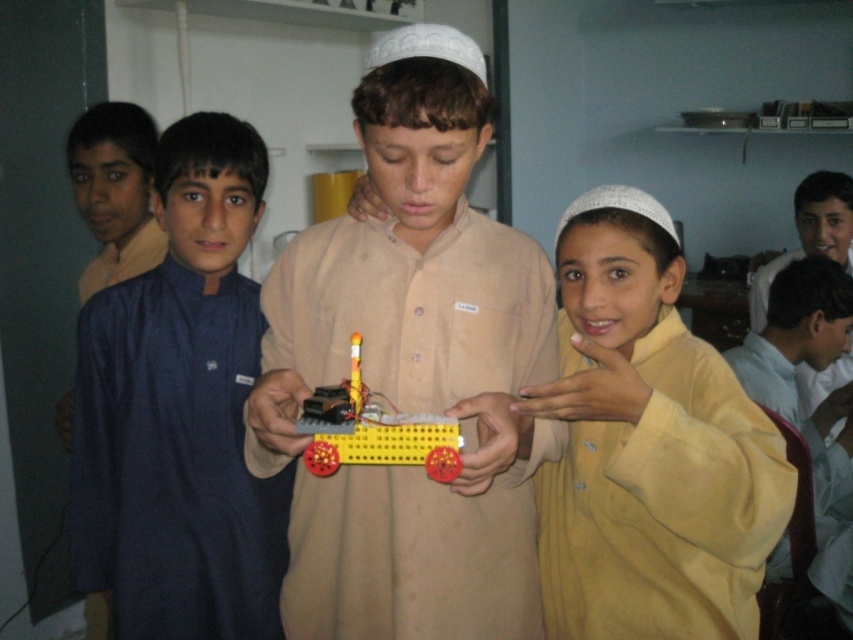
Is yellow matte shirt at lower right to the right of yellow plastic toy at center from the viewer's perspective?

Yes, yellow matte shirt at lower right is to the right of yellow plastic toy at center.

Does yellow matte shirt at lower right have a greater width compared to yellow plastic toy at center?

Yes.

Measure the distance between yellow matte shirt at lower right and camera.

A distance of 2.12 meters exists between yellow matte shirt at lower right and camera.

This screenshot has width=853, height=640. Identify the location of yellow matte shirt at lower right. (819, 404).

Is beige matte shirt at center taller than dark blue fabric at left?

No.

Is point (451, 410) in front of point (97, 406)?

Yes, point (451, 410) is closer to viewer.

Which is in front, point (450, 225) or point (231, 243)?

Point (450, 225)

The image size is (853, 640). Find the location of `beige matte shirt at center`. beige matte shirt at center is located at coordinates (413, 371).

Which is more to the left, yellow plastic toy at center or light blue shirt at upper right?

yellow plastic toy at center

Does yellow plastic toy at center have a lesser width compared to light blue shirt at upper right?

Yes, yellow plastic toy at center is thinner than light blue shirt at upper right.

Measure the distance between yellow plastic toy at center and camera.

yellow plastic toy at center is 38.81 inches from camera.

The width and height of the screenshot is (853, 640). Identify the location of yellow plastic toy at center. (373, 429).